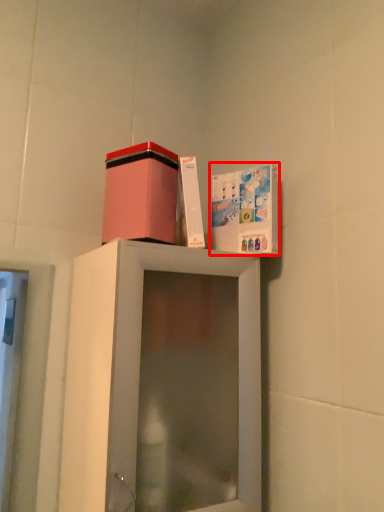
Question: Considering the relative positions of cabinet (annotated by the red box) and cardboard box in the image provided, where is cabinet (annotated by the red box) located with respect to the staircase?

Choices:
 (A) left
 (B) right

Answer: (B)